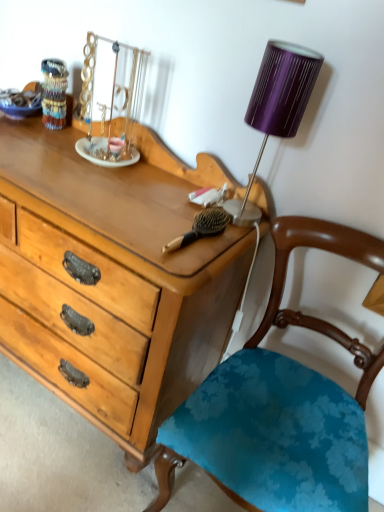
The image size is (384, 512). I want to click on purple ribbed fabric lampshade at upper right, so [281, 94].

This screenshot has height=512, width=384. Describe the element at coordinates (281, 405) in the screenshot. I see `blue floral fabric chair at center` at that location.

Describe the element at coordinates (20, 103) in the screenshot. Image resolution: width=384 pixels, height=512 pixels. I see `multicolored glass beads at upper left` at that location.

What is the approximate width of multicolored glass beads at upper left?

6.92 inches.

At what (x,y) coordinates should I click in order to perform the action: click on purple ribbed fabric lampshade at upper right. Please return your answer as a coordinate pair (x, y). The image size is (384, 512). Looking at the image, I should click on (281, 94).

From the picture: What's the angular difference between blue floral fabric chair at center and purple ribbed fabric lampshade at upper right's facing directions?

0.761 degrees separate the facing orientations of blue floral fabric chair at center and purple ribbed fabric lampshade at upper right.

Considering the positions of objects blue floral fabric chair at center and purple ribbed fabric lampshade at upper right in the image provided, who is in front, blue floral fabric chair at center or purple ribbed fabric lampshade at upper right?

blue floral fabric chair at center is more forward.

Based on the photo, is blue floral fabric chair at center bigger than purple ribbed fabric lampshade at upper right?

Indeed, blue floral fabric chair at center has a larger size compared to purple ribbed fabric lampshade at upper right.

Are blue floral fabric chair at center and purple ribbed fabric lampshade at upper right located far from each other?

No.

Which is more to the right, multicolored glass beads at upper left or blue floral fabric chair at center?

blue floral fabric chair at center is more to the right.

From a real-world perspective, which object rests below the other?

From a 3D spatial view, blue floral fabric chair at center is below.

In terms of width, does multicolored glass beads at upper left look wider or thinner when compared to blue floral fabric chair at center?

Clearly, multicolored glass beads at upper left has less width compared to blue floral fabric chair at center.

Relative to blue floral fabric chair at center, is multicolored glass beads at upper left in front or behind?

multicolored glass beads at upper left is positioned farther from the viewer than blue floral fabric chair at center.

Consider the image. Which of these two, purple ribbed fabric lampshade at upper right or multicolored glass beads at upper left, stands taller?

With more height is purple ribbed fabric lampshade at upper right.

From the image's perspective, would you say purple ribbed fabric lampshade at upper right is positioned over multicolored glass beads at upper left?

Incorrect, from the image's perspective, purple ribbed fabric lampshade at upper right is lower than multicolored glass beads at upper left.

Considering the sizes of objects purple ribbed fabric lampshade at upper right and multicolored glass beads at upper left in the image provided, who is smaller, purple ribbed fabric lampshade at upper right or multicolored glass beads at upper left?

multicolored glass beads at upper left.

Is purple ribbed fabric lampshade at upper right further to the viewer compared to multicolored glass beads at upper left?

No, purple ribbed fabric lampshade at upper right is closer to the viewer.

Based on the photo, is blue floral fabric chair at center thinner than brown wooden brush at center?

In fact, blue floral fabric chair at center might be wider than brown wooden brush at center.

Which is correct: blue floral fabric chair at center is inside brown wooden brush at center, or outside of it?

blue floral fabric chair at center is not enclosed by brown wooden brush at center.

Locate an element on the screen. This screenshot has width=384, height=512. brush that appears above the blue floral fabric chair at center (from a real-world perspective) is located at coordinates (x=201, y=228).

From the image's perspective, which one is positioned lower, blue floral fabric chair at center or brown wooden brush at center?

blue floral fabric chair at center is shown below in the image.

Between brown wooden brush at center and multicolored glass beads at upper left, which one is positioned in front?

brown wooden brush at center is more forward.

From a real-world perspective, is brown wooden brush at center above or below multicolored glass beads at upper left?

brown wooden brush at center is situated lower than multicolored glass beads at upper left in the real world.

You are a GUI agent. You are given a task and a screenshot of the screen. Output one action in this format:
    pyautogui.click(x=<x>, y=<y>)
    Task: Click on the brush that is under the multicolored glass beads at upper left (from a real-world perspective)
    The image size is (384, 512).
    Given the screenshot: What is the action you would take?
    pyautogui.click(x=201, y=228)

How different are the orientations of brown wooden brush at center and multicolored glass beads at upper left in degrees?

They differ by 0.00481 degrees in their facing directions.

The height and width of the screenshot is (512, 384). Find the location of `plate on the left of brown wooden brush at center`. plate on the left of brown wooden brush at center is located at coordinates (20, 103).

Considering their positions, is multicolored glass beads at upper left located in front of or behind brown wooden brush at center?

multicolored glass beads at upper left is behind brown wooden brush at center.

From a real-world perspective, is multicolored glass beads at upper left located beneath brown wooden brush at center?

Actually, multicolored glass beads at upper left is physically above brown wooden brush at center in the real world.

Can you confirm if multicolored glass beads at upper left is thinner than brown wooden brush at center?

Indeed, multicolored glass beads at upper left has a lesser width compared to brown wooden brush at center.

Consider the image. From the image's perspective, is multicolored glass beads at upper left over purple ribbed fabric lampshade at upper right?

Yes, from the image's perspective, multicolored glass beads at upper left is above purple ribbed fabric lampshade at upper right.

Which is more to the right, multicolored glass beads at upper left or purple ribbed fabric lampshade at upper right?

From the viewer's perspective, purple ribbed fabric lampshade at upper right appears more on the right side.

Between multicolored glass beads at upper left and purple ribbed fabric lampshade at upper right, which one is positioned in front?

purple ribbed fabric lampshade at upper right is in front.

Which object is wider, multicolored glass beads at upper left or purple ribbed fabric lampshade at upper right?

Wider between the two is multicolored glass beads at upper left.

Identify the location of chair lying in front of the purple ribbed fabric lampshade at upper right. Image resolution: width=384 pixels, height=512 pixels. (281, 405).

Where is `plate located above the blue floral fabric chair at center (from the image's perspective)`? This screenshot has width=384, height=512. plate located above the blue floral fabric chair at center (from the image's perspective) is located at coordinates (20, 103).

Looking at the image, which one is located further to purple ribbed fabric lampshade at upper right, brown wooden brush at center or blue floral fabric chair at center?

Based on the image, blue floral fabric chair at center appears to be further to purple ribbed fabric lampshade at upper right.

Which object lies nearer to the anchor point blue floral fabric chair at center, multicolored glass beads at upper left or brown wooden brush at center?

Based on the image, brown wooden brush at center appears to be nearer to blue floral fabric chair at center.

Considering their positions, is purple ribbed fabric lampshade at upper right positioned further to multicolored glass beads at upper left than brown wooden brush at center?

Among the two, purple ribbed fabric lampshade at upper right is located further to multicolored glass beads at upper left.

Based on their spatial positions, is brown wooden brush at center or purple ribbed fabric lampshade at upper right closer to blue floral fabric chair at center?

brown wooden brush at center is closer to blue floral fabric chair at center.

Considering their positions, is brown wooden brush at center positioned closer to blue floral fabric chair at center than multicolored glass beads at upper left?

brown wooden brush at center lies closer to blue floral fabric chair at center than the other object.

Which object lies further to the anchor point purple ribbed fabric lampshade at upper right, blue floral fabric chair at center or brown wooden brush at center?

Among the two, blue floral fabric chair at center is located further to purple ribbed fabric lampshade at upper right.

Based on their spatial positions, is blue floral fabric chair at center or purple ribbed fabric lampshade at upper right further from multicolored glass beads at upper left?

blue floral fabric chair at center.

Considering their positions, is brown wooden brush at center positioned closer to purple ribbed fabric lampshade at upper right than multicolored glass beads at upper left?

Among the two, brown wooden brush at center is located nearer to purple ribbed fabric lampshade at upper right.

The width and height of the screenshot is (384, 512). Find the location of `brush between purple ribbed fabric lampshade at upper right and blue floral fabric chair at center in the vertical direction`. brush between purple ribbed fabric lampshade at upper right and blue floral fabric chair at center in the vertical direction is located at coordinates (201, 228).

Where is `lamp between multicolored glass beads at upper left and blue floral fabric chair at center vertically`? The image size is (384, 512). lamp between multicolored glass beads at upper left and blue floral fabric chair at center vertically is located at coordinates pyautogui.click(x=281, y=94).

Find the location of a particular element. The width and height of the screenshot is (384, 512). brush between multicolored glass beads at upper left and purple ribbed fabric lampshade at upper right in the horizontal direction is located at coordinates (201, 228).

The width and height of the screenshot is (384, 512). Find the location of `brush between multicolored glass beads at upper left and blue floral fabric chair at center in the up-down direction`. brush between multicolored glass beads at upper left and blue floral fabric chair at center in the up-down direction is located at coordinates (201, 228).